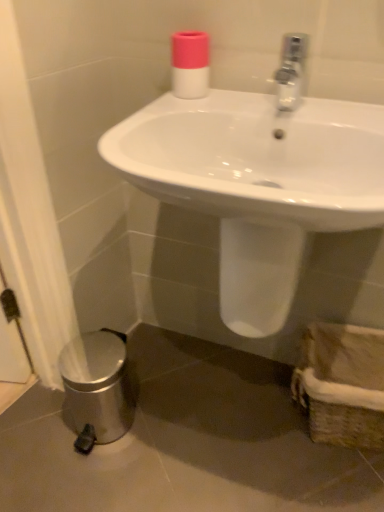
Question: Can you confirm if brown woven basket at lower right is bigger than white glossy sink at center?

Choices:
 (A) no
 (B) yes

Answer: (A)

Question: Is white glossy sink at center completely or partially inside brown woven basket at lower right?

Choices:
 (A) no
 (B) yes

Answer: (A)

Question: From a real-world perspective, is brown woven basket at lower right physically below white glossy sink at center?

Choices:
 (A) yes
 (B) no

Answer: (A)

Question: Is brown woven basket at lower right behind white glossy sink at center?

Choices:
 (A) yes
 (B) no

Answer: (A)

Question: From the image's perspective, does brown woven basket at lower right appear higher than white glossy sink at center?

Choices:
 (A) yes
 (B) no

Answer: (B)

Question: From the image's perspective, is white glossy sink at center above or below pink matte bottle at upper center?

Choices:
 (A) above
 (B) below

Answer: (B)

Question: Considering the positions of white glossy sink at center and pink matte bottle at upper center in the image, is white glossy sink at center bigger or smaller than pink matte bottle at upper center?

Choices:
 (A) small
 (B) big

Answer: (B)

Question: Is point (155, 156) closer or farther from the camera than point (208, 87)?

Choices:
 (A) closer
 (B) farther

Answer: (A)

Question: From a real-world perspective, is white glossy sink at center physically located above or below pink matte bottle at upper center?

Choices:
 (A) above
 (B) below

Answer: (B)

Question: Is pink matte bottle at upper center taller or shorter than white glossy sink at center?

Choices:
 (A) tall
 (B) short

Answer: (B)

Question: Visually, is pink matte bottle at upper center positioned to the left or to the right of white glossy sink at center?

Choices:
 (A) right
 (B) left

Answer: (B)

Question: Relative to white glossy sink at center, is pink matte bottle at upper center in front or behind?

Choices:
 (A) front
 (B) behind

Answer: (B)

Question: From the image's perspective, relative to white glossy sink at center, is pink matte bottle at upper center above or below?

Choices:
 (A) below
 (B) above

Answer: (B)

Question: From the image's perspective, is brown woven basket at lower right located above or below pink matte bottle at upper center?

Choices:
 (A) below
 (B) above

Answer: (A)

Question: Based on their sizes in the image, would you say brown woven basket at lower right is bigger or smaller than pink matte bottle at upper center?

Choices:
 (A) big
 (B) small

Answer: (A)